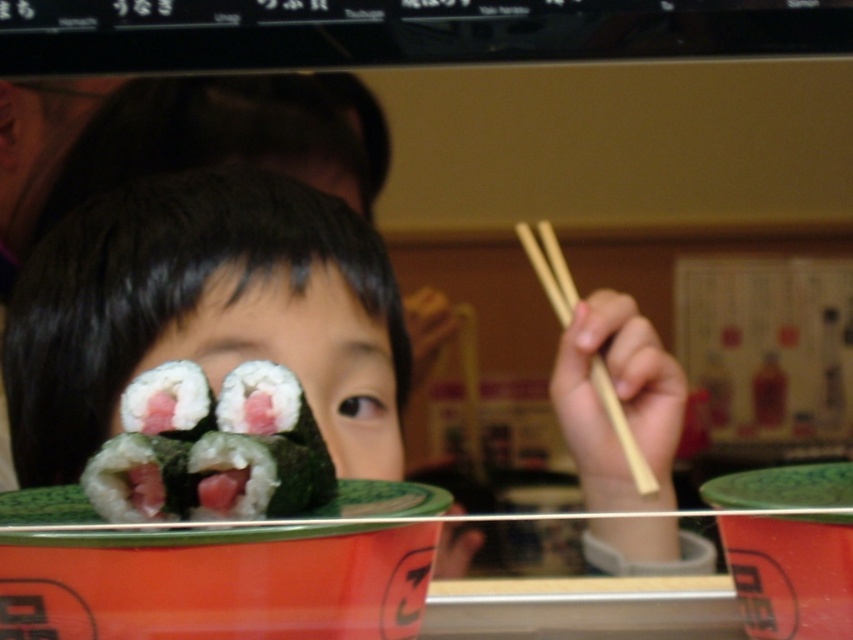
You are standing in a sushi restaurant and want to place a small napkin at point (x=312, y=502). If your hand is 18 inches long, can you reach that point without moving your feet?

The distance between you and point (x=312, y=502) is 18.34 inches. Since your hand is 18 inches long, you cannot quite reach the point without moving your feet.

From the picture: You are a photographer taking a picture of the sushi restaurant scene. You notice two points in the image labeled as point 1 at coordinate (94, 323) and point 2 at coordinate (242, 512). Which point is closer to the camera?

Point 1 at coordinate (94, 323) is closer to the camera than point 2 at coordinate (242, 512) because it is further to the camera than the other point.

You are a sushi chef preparing a plate for a customer. You have a green seaweed wrapped sushi at center and wooden chopsticks at right. Which item should you place closer to the customer to ensure they can easily pick up the sushi with the chopsticks?

The green seaweed wrapped sushi at center is smaller than the wooden chopsticks at right, so you should place the wooden chopsticks at right closer to the customer. This way, the chopsticks will be within easy reach to pick up the smaller sushi piece.